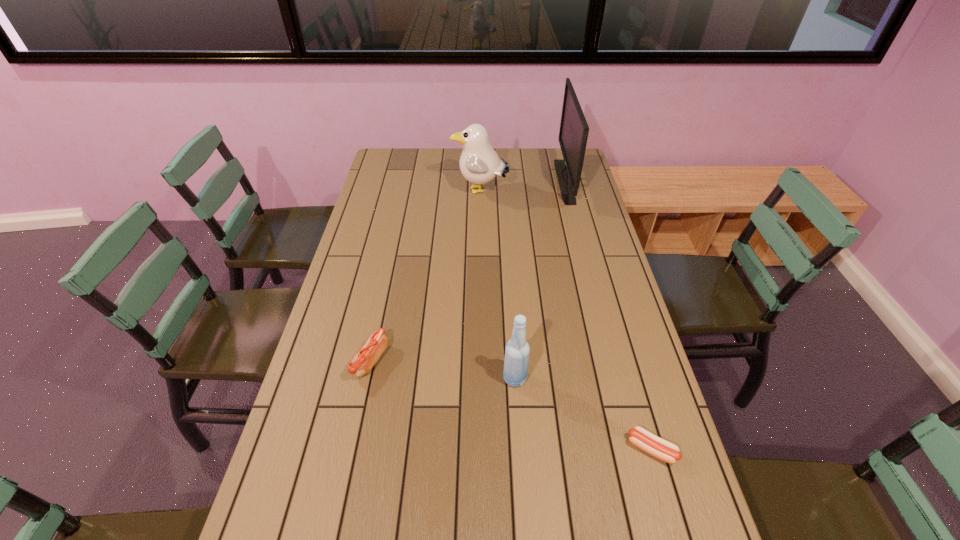
Where is `vacant space located 0.290m on the beak of the gull`? This screenshot has height=540, width=960. vacant space located 0.290m on the beak of the gull is located at coordinates [x=382, y=192].

Where is `vacant space situated 0.250m on the beak of the gull`? This screenshot has height=540, width=960. vacant space situated 0.250m on the beak of the gull is located at coordinates (392, 192).

Where is `vacant space located 0.100m on the beak of the gull`? Image resolution: width=960 pixels, height=540 pixels. vacant space located 0.100m on the beak of the gull is located at coordinates (428, 192).

Find the location of a particular element. The width and height of the screenshot is (960, 540). blank area located on the back of the third tallest object is located at coordinates click(x=513, y=339).

The width and height of the screenshot is (960, 540). In order to click on free space located on the back of the leftmost object in this screenshot , I will do `click(380, 316)`.

The height and width of the screenshot is (540, 960). I want to click on vacant region located 0.320m on the back of the shorter sausage, so click(x=617, y=328).

At what (x,y) coordinates should I click in order to perform the action: click on object that is at the far edge. Please return your answer as a coordinate pair (x, y). The image size is (960, 540). Looking at the image, I should click on (573, 134).

The height and width of the screenshot is (540, 960). Identify the location of object at the left edge. (363, 361).

What are the coordinates of `monitor that is at the right edge` in the screenshot? It's located at (573, 134).

Find the location of a particular element. This screenshot has height=540, width=960. sausage that is at the right edge is located at coordinates (662, 449).